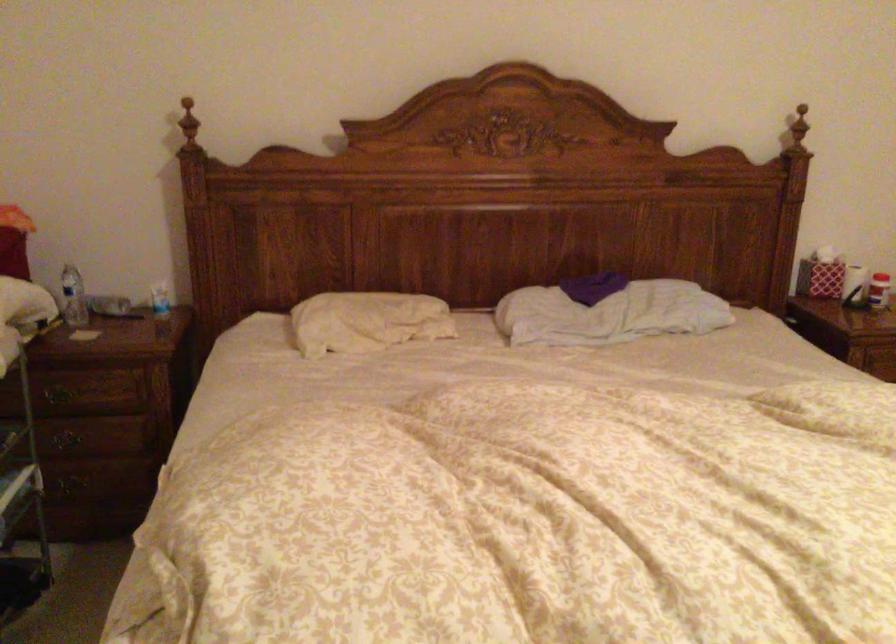
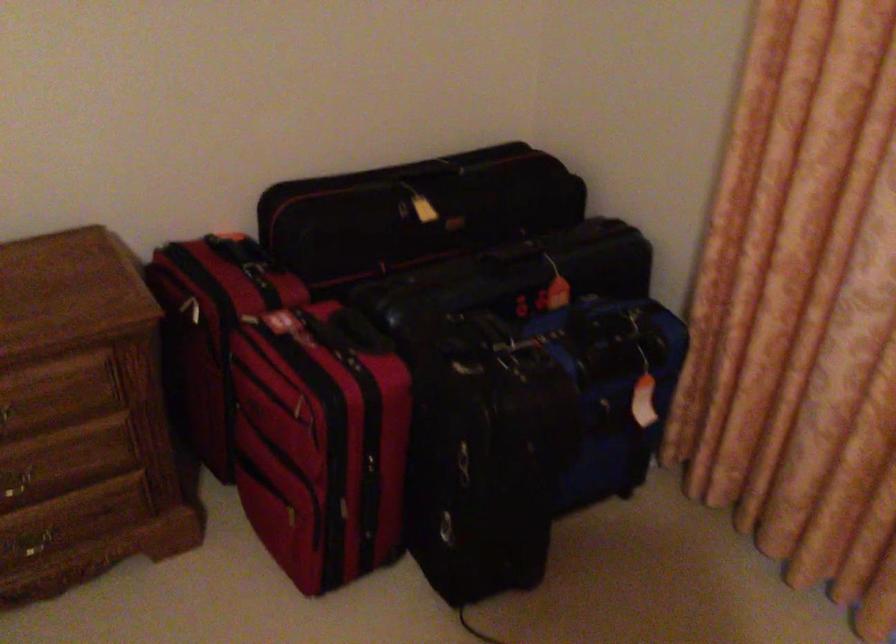
From the picture: What movement of the cameraman would produce the second image?

The movement direction of the cameraman is right, forward.